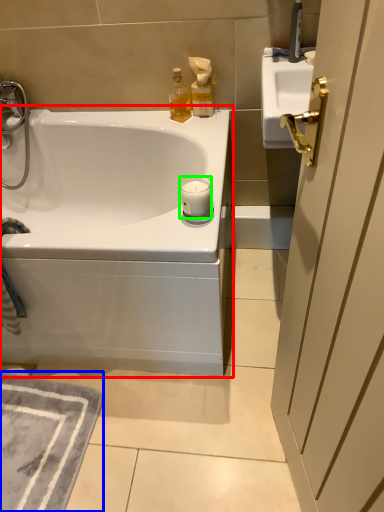
Question: Which object is the closest to the bathtub (highlighted by a red box)? Choose among these: bath mat (highlighted by a blue box) or candle (highlighted by a green box).

Choices:
 (A) bath mat
 (B) candle

Answer: (A)